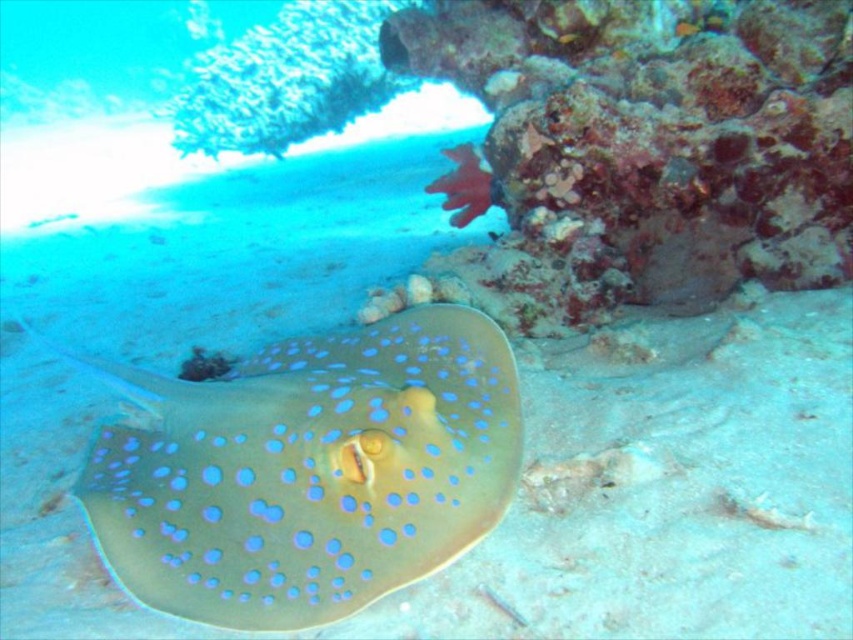
You are a marine biologist observing the underwater scene. You notice the rusty coral reef at upper right and the blue glossy stingray at center. Which object is larger in size?

The rusty coral reef at upper right is bigger than the blue glossy stingray at center according to the description.

You are a marine biologist observing the underwater scene. You notice the rusty coral reef at upper right and the blue glossy stingray at center. Which object is located to the right of the other?

The rusty coral reef at upper right is positioned on the right side of blue glossy stingray at center, so the rusty coral reef at upper right is to the right of the blue glossy stingray at center.